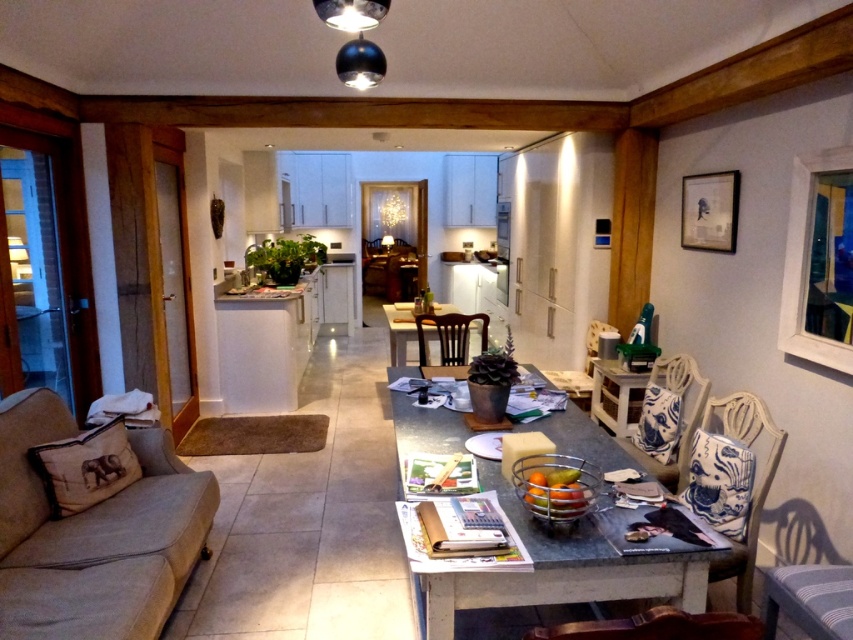
Question: Which point appears farthest from the camera in this image?

Choices:
 (A) [x=422, y=604]
 (B) [x=119, y=627]
 (C) [x=685, y=371]
 (D) [x=732, y=182]

Answer: (D)

Question: Which of the following is the farthest from the observer?

Choices:
 (A) (593, 634)
 (B) (705, 244)

Answer: (B)

Question: Which point is closer to the camera?

Choices:
 (A) tap(801, 621)
 (B) tap(573, 636)
 (C) tap(616, 385)

Answer: (B)

Question: Is the position of striped fabric chair at lower right more distant than that of wooden armchair at center?

Choices:
 (A) yes
 (B) no

Answer: (B)

Question: Is granite table at center further to camera compared to wooden armchair at center?

Choices:
 (A) yes
 (B) no

Answer: (B)

Question: Where is wooden chair at lower center located in relation to matte black picture frame at upper right in the image?

Choices:
 (A) below
 (B) above

Answer: (A)